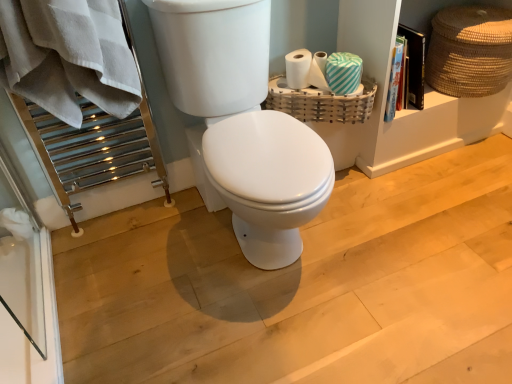
Identify the location of spots to the right of white glossy toilet at center. Image resolution: width=512 pixels, height=384 pixels. (401, 227).